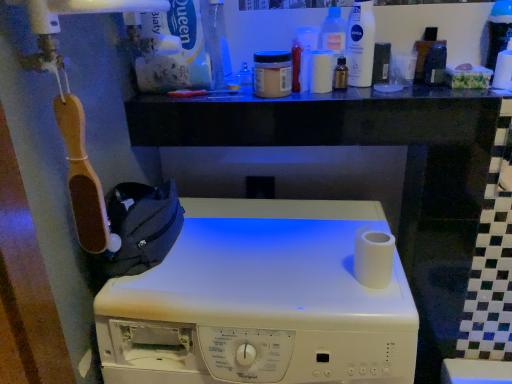
At what (x,y) coordinates should I click in order to perform the action: click on vacant space in front of translucent plastic bottle at upper center, which is counted as the 1th cleaning product, starting from the left. Please return your answer as a coordinate pair (x, y). The width and height of the screenshot is (512, 384). Looking at the image, I should click on (351, 91).